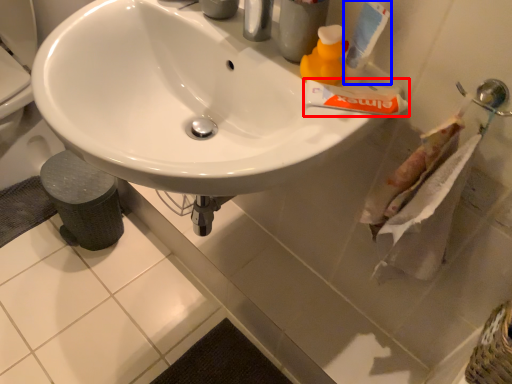
Question: Which object appears farthest to the camera in this image, toothpaste (highlighted by a red box) or toothpaste (highlighted by a blue box)?

Choices:
 (A) toothpaste
 (B) toothpaste

Answer: (A)